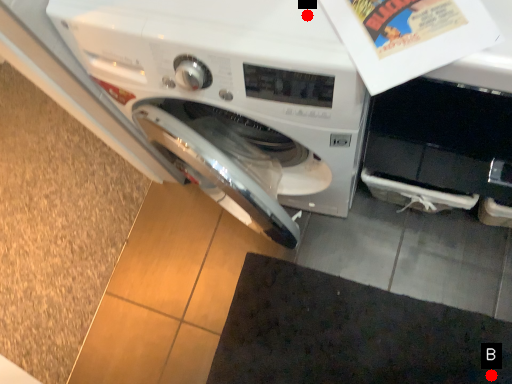
Question: Two points are circled on the image, labeled by A and B beside each circle. Which point is farther from the camera taking this photo?

Choices:
 (A) A is further
 (B) B is further

Answer: (B)